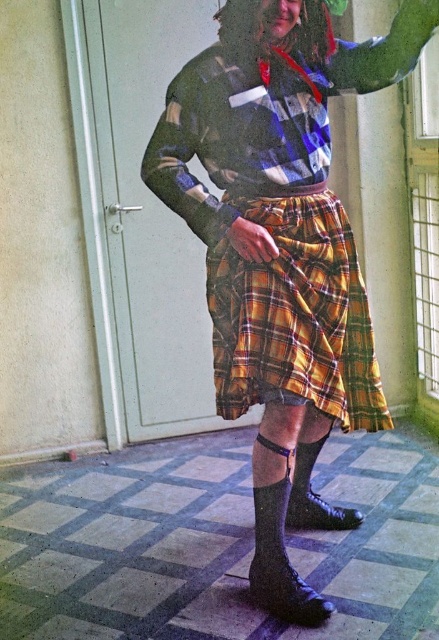
You are a costume designer preparing for a play. You need to ensure that the yellow plaid kilt at center and the black matte sock at lower center are visible to the audience. Given their sizes, which item will likely be more prominent in the performance?

The yellow plaid kilt at center is larger in size than the black matte sock at lower center, so it will likely be more prominent in the performance.

You are a fashion designer observing the person in the scene. You need to determine which sock, the black suede sock at lower center or the black matte sock at lower center, extends higher up the leg. Which one is taller?

The black suede sock at lower center has a greater height compared to the black matte sock at lower center, so the black suede sock at lower center is taller.